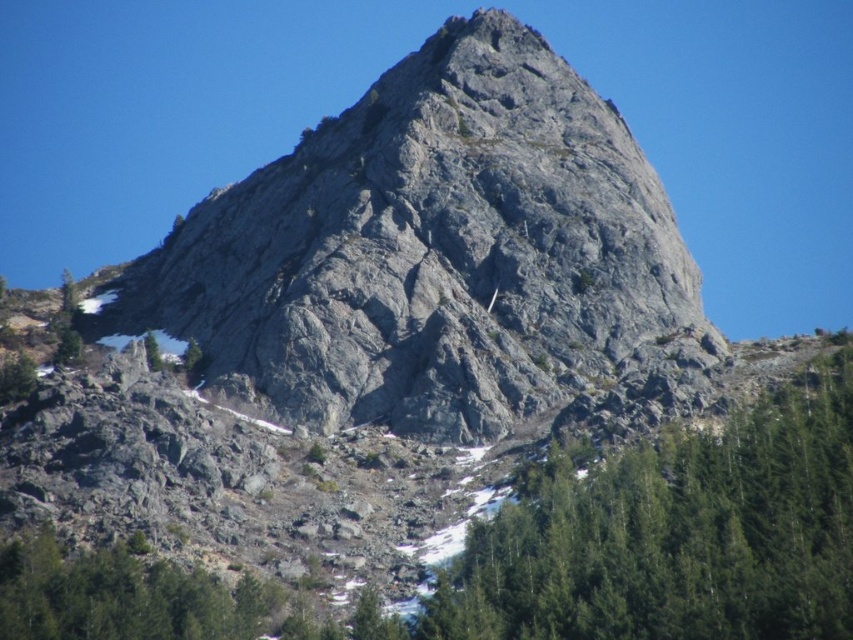
You are a hiker standing at the base of the mountain. You see the gray rocky mountain at center and the green textured tree at center. Which object is positioned to the left when facing the mountain?

The gray rocky mountain at center is positioned to the left of the green textured tree at center when facing the mountain.

You are a hiker planning to reach the summit of the mountain. You notice two landmarks on your map corresponding to the coordinates point (422, 186) and point (651, 547). Which of these landmarks is closer to the summit?

Point (651, 547) is closer to the summit because it is in front of point (422, 186), which is behind it.

You are standing at the base of the mountain and see the green textured tree at center and the green matte tree at lower left. Which tree is closer to your right side?

The green textured tree at center is positioned on the right side of the green matte tree at lower left, so it is closer to your right side.